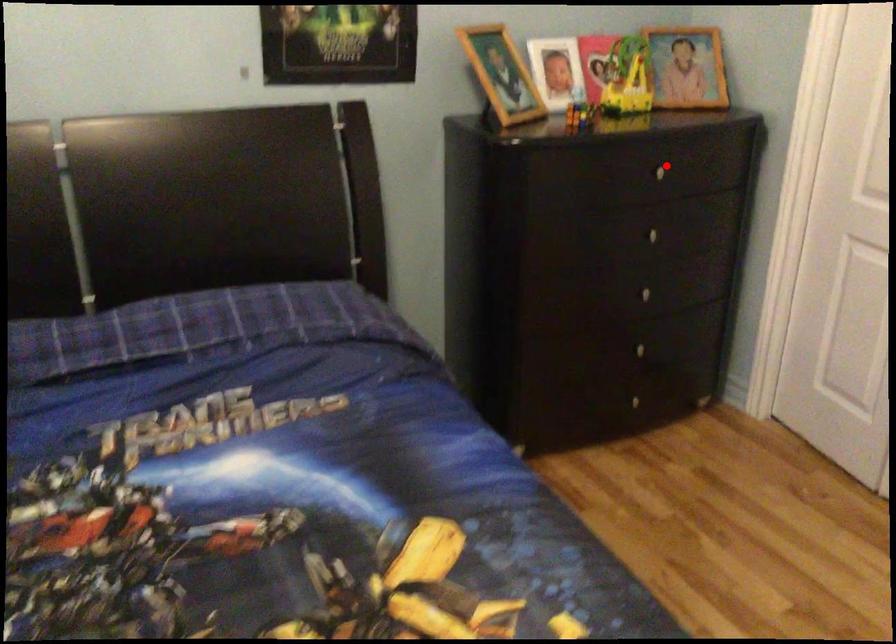
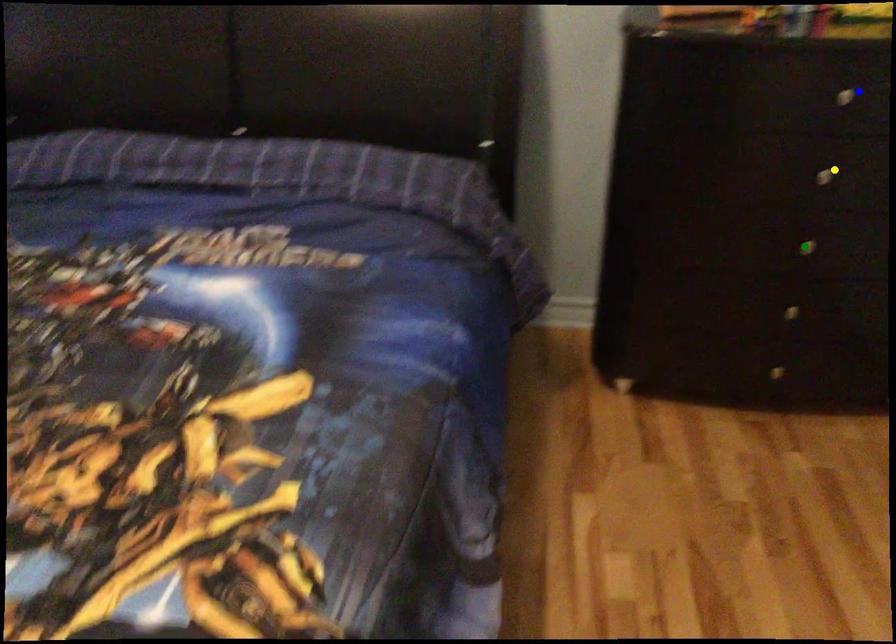
Question: I am providing you with two images of the same scene from different viewpoints. A red point is marked on the first image. You are given multiple points on the second image. Which spot in image 2 lines up with the point in image 1?

Choices:
 (A) blue point
 (B) green point
 (C) yellow point

Answer: (A)